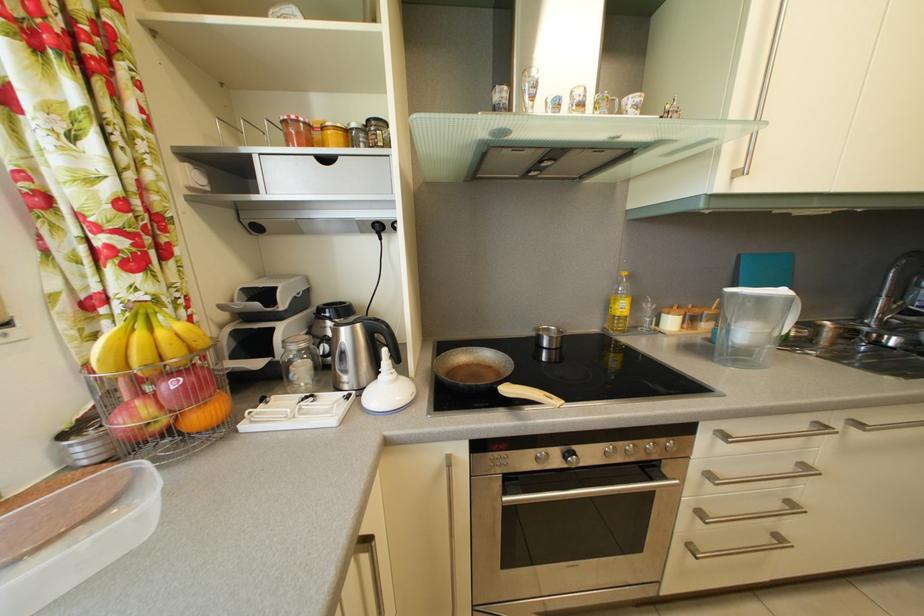
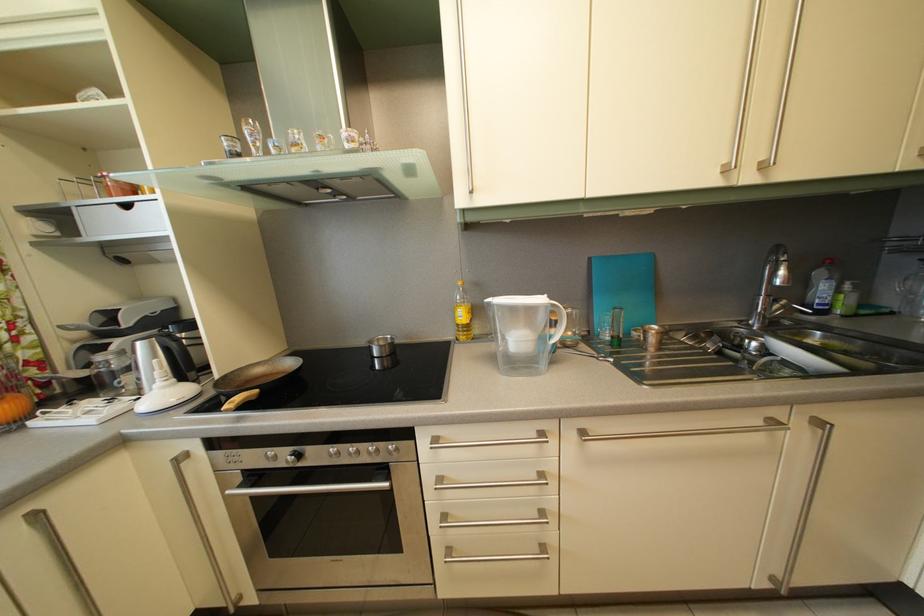
Question: The camera is either moving clockwise (left) or counter-clockwise (right) around the object. The first image is from the beginning of the video and the second image is from the end. Is the camera moving left or right when shooting the video?

Choices:
 (A) Left
 (B) Right

Answer: (B)